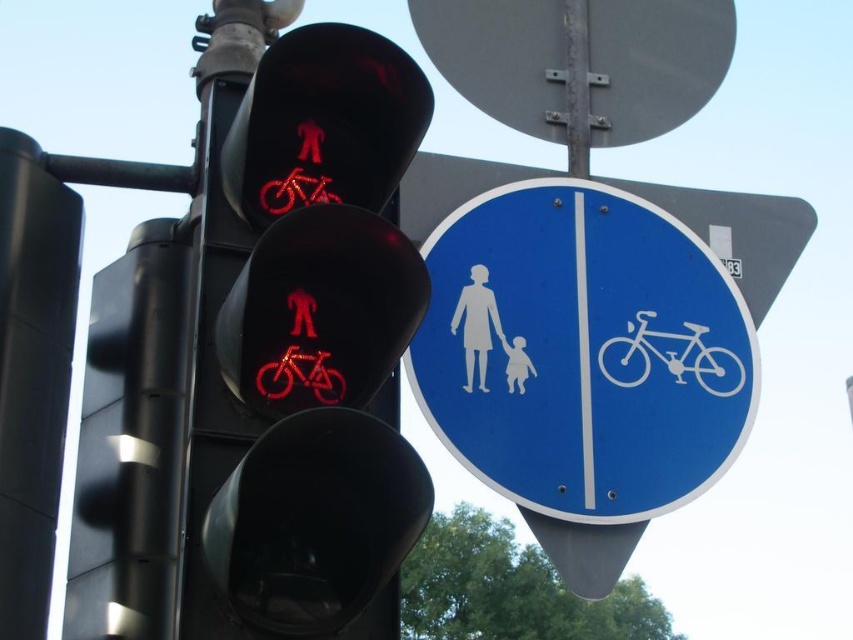
Question: From the image, what is the correct spatial relationship of white matte bicycle at center in relation to white matte figure at center?

Choices:
 (A) above
 (B) below

Answer: (B)

Question: Among these objects, which one is nearest to the camera?

Choices:
 (A) red matte pedestrian signal at upper left
 (B) white matte bicycle at center

Answer: (A)

Question: Which is nearer to the red matte pedestrian signal at upper left?

Choices:
 (A) white matte figure at center
 (B) white matte bicycle at center
 (C) smooth gray circle at upper center

Answer: (A)

Question: Which object appears closest to the camera in this image?

Choices:
 (A) white matte bicycle at center
 (B) smooth gray circle at upper center
 (C) red matte pedestrian signal at upper left
 (D) white matte figure at center

Answer: (C)

Question: Is smooth gray circle at upper center bigger than white matte bicycle at center?

Choices:
 (A) no
 (B) yes

Answer: (B)

Question: Can you confirm if smooth gray circle at upper center is positioned to the left of white matte figure at center?

Choices:
 (A) no
 (B) yes

Answer: (A)